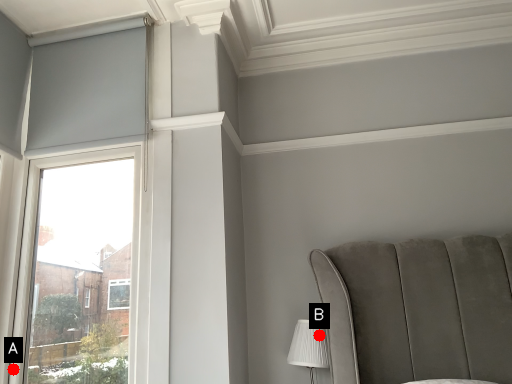
Question: Two points are circled on the image, labeled by A and B beside each circle. Which point is further to the camera?

Choices:
 (A) A is further
 (B) B is further

Answer: (B)